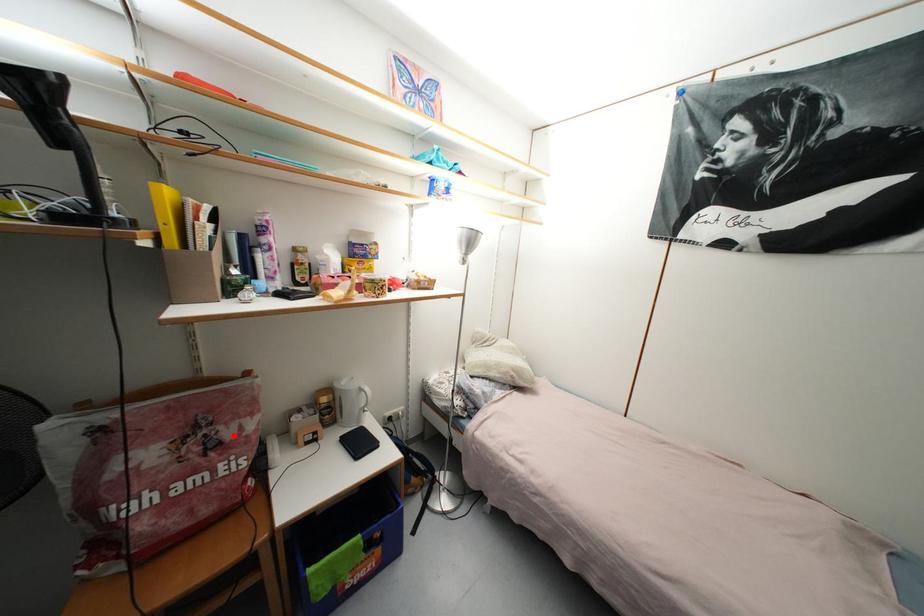
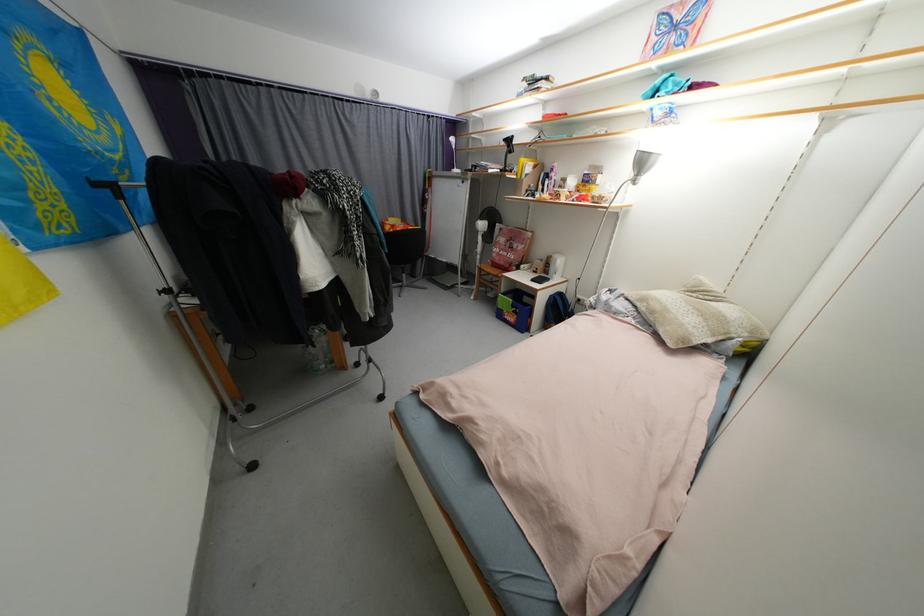
In the second image, find the point that corresponds to the highlighted location in the first image.

(520, 248)